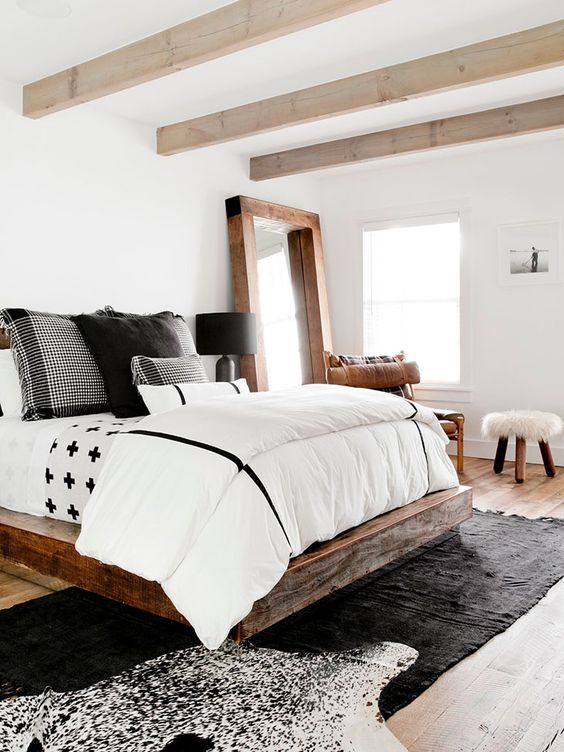
Find the location of `white blanket`. white blanket is located at coordinates (255, 431).